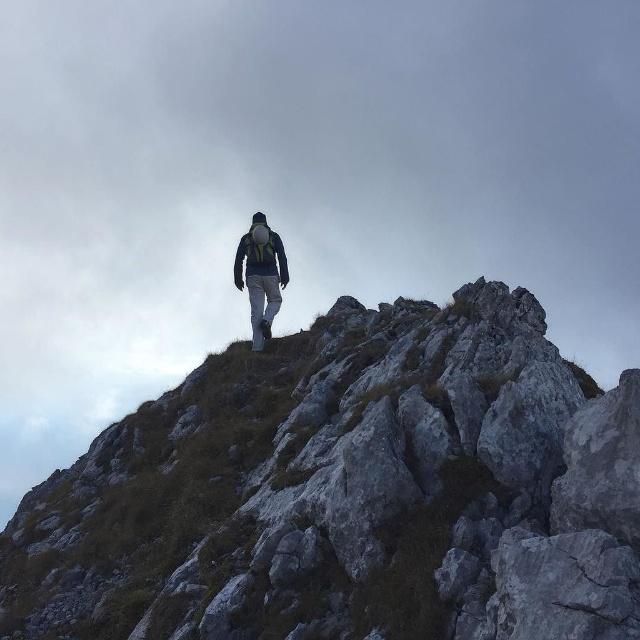
You are the hiker in the image. You notice your matte gray pants at center and the gray rocky mountain at center. Which object is positioned lower in the scene?

The gray rocky mountain at center is located below matte gray pants at center, so the mountain is positioned lower than the pants.

You are the hiker in the image. You need to move from your current position to the gray rocky mountain at center. Which direction should you move relative to your dark green fabric jacket at center?

The gray rocky mountain at center is to the right of the dark green fabric jacket at center, so you should move to the right relative to your jacket to reach it.

You are the hiker in the image and want to place a marker at point (333, 452) and point (269, 236). Which point is closer to your current position?

Point (333, 452) is closer to the camera than point (269, 236), so the marker at point (333, 452) would be closer to your current position.